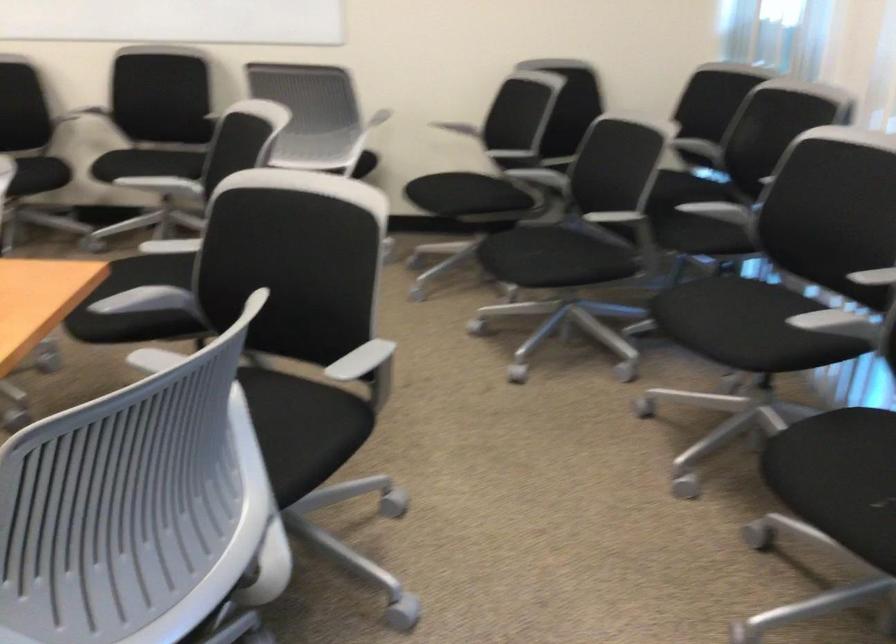
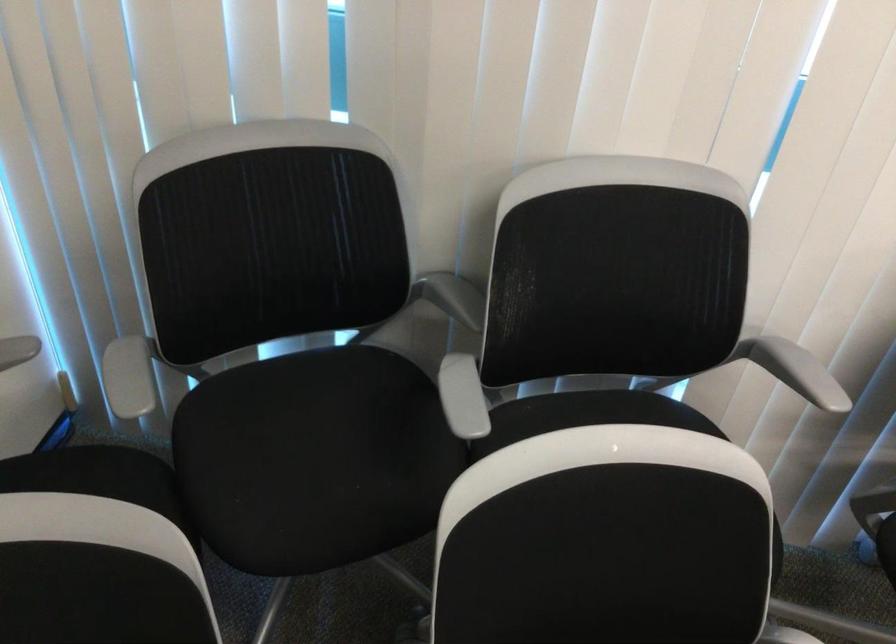
Locate, in the second image, the point that corresponds to (x=676, y=176) in the first image.

(312, 442)